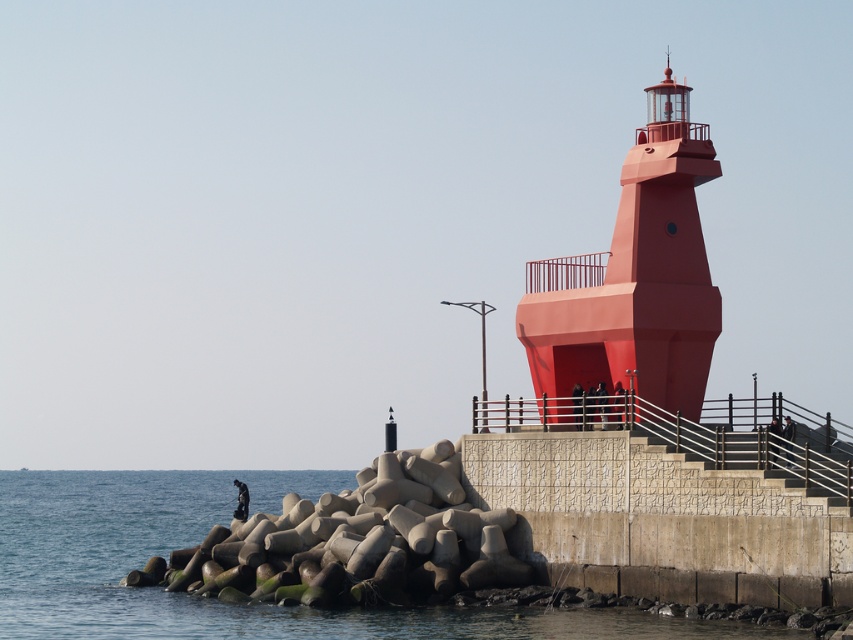
Question: Where is transparent water at lower left located in relation to matte red tower at center in the image?

Choices:
 (A) above
 (B) below

Answer: (B)

Question: Which point is farther from the camera taking this photo?

Choices:
 (A) (85, 564)
 (B) (583, 358)

Answer: (A)

Question: Is blue concrete water at lower left below matte red tower at center?

Choices:
 (A) no
 (B) yes

Answer: (B)

Question: Estimate the real-world distances between objects in this image. Which object is closer to the transparent water at lower left?

Choices:
 (A) matte red tower at center
 (B) blue concrete water at lower left

Answer: (B)

Question: Which point is farther to the camera?

Choices:
 (A) (15, 589)
 (B) (126, 502)
 (C) (656, 262)

Answer: (B)

Question: Where is blue concrete water at lower left located in relation to matte red tower at center in the image?

Choices:
 (A) above
 (B) below

Answer: (B)